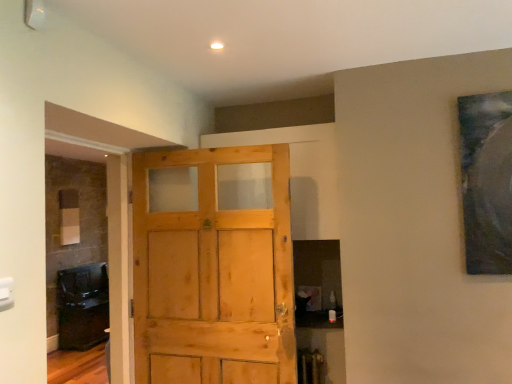
Question: Does dark brown wood cabinet at left have a greater width compared to light brown wood door at center?

Choices:
 (A) no
 (B) yes

Answer: (B)

Question: Does dark brown wood cabinet at left appear on the left side of light brown wood door at center?

Choices:
 (A) yes
 (B) no

Answer: (A)

Question: Is dark brown wood cabinet at left positioned far away from light brown wood door at center?

Choices:
 (A) yes
 (B) no

Answer: (A)

Question: Considering the relative sizes of dark brown wood cabinet at left and light brown wood door at center in the image provided, is dark brown wood cabinet at left shorter than light brown wood door at center?

Choices:
 (A) yes
 (B) no

Answer: (A)

Question: Is light brown wood door at center a part of dark brown wood cabinet at left?

Choices:
 (A) yes
 (B) no

Answer: (B)

Question: Considering the relative sizes of dark brown wood cabinet at left and light brown wood door at center in the image provided, is dark brown wood cabinet at left thinner than light brown wood door at center?

Choices:
 (A) yes
 (B) no

Answer: (B)

Question: Is light brown wood door at center positioned before dark brown wood cabinet at left?

Choices:
 (A) yes
 (B) no

Answer: (A)

Question: Can you confirm if light brown wood door at center is wider than dark brown wood cabinet at left?

Choices:
 (A) yes
 (B) no

Answer: (B)

Question: Is light brown wood door at center far from dark brown wood cabinet at left?

Choices:
 (A) yes
 (B) no

Answer: (A)

Question: Does light brown wood door at center appear on the left side of dark brown wood cabinet at left?

Choices:
 (A) yes
 (B) no

Answer: (B)

Question: From the image's perspective, is light brown wood door at center located beneath dark brown wood cabinet at left?

Choices:
 (A) no
 (B) yes

Answer: (A)

Question: Is the position of light brown wood door at center more distant than that of dark brown wood cabinet at left?

Choices:
 (A) no
 (B) yes

Answer: (A)

Question: In terms of height, does light brown wood door at center look taller or shorter compared to dark brown wood cabinet at left?

Choices:
 (A) tall
 (B) short

Answer: (A)